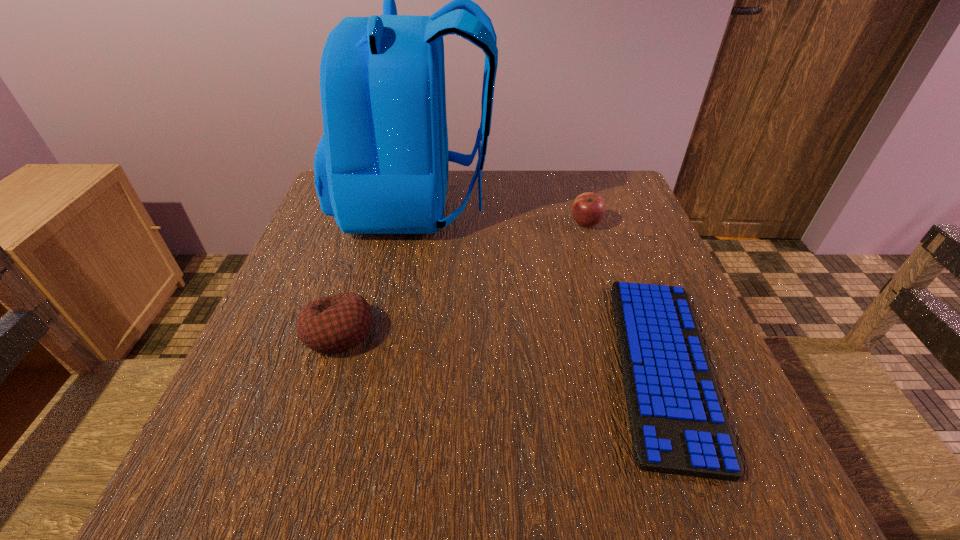
In the image, there is a desktop. At what (x,y) coordinates should I click in order to perform the action: click on vacant area at the right edge. Please return your answer as a coordinate pair (x, y). Looking at the image, I should click on (588, 250).

The height and width of the screenshot is (540, 960). Identify the location of free space at the far left corner. (327, 219).

This screenshot has width=960, height=540. In the image, there is a desktop. In order to click on vacant space at the near left corner in this screenshot , I will do `click(233, 458)`.

In the image, there is a desktop. Identify the location of vacant space at the far right corner. (606, 175).

At what (x,y) coordinates should I click in order to perform the action: click on free point at the near right corner. Please return your answer as a coordinate pair (x, y). This screenshot has height=540, width=960. Looking at the image, I should click on (717, 489).

Where is `free space that is in between the third tallest object and the shortest object`? free space that is in between the third tallest object and the shortest object is located at coordinates (501, 349).

You are a GUI agent. You are given a task and a screenshot of the screen. Output one action in this format:
    pyautogui.click(x=<x>, y=<y>)
    Task: Click on the unoccupied area between the second shortest object and the apple
    The image size is (960, 540).
    Given the screenshot: What is the action you would take?
    pyautogui.click(x=463, y=278)

Locate an element on the screen. This screenshot has height=540, width=960. vacant point located between the apple and the third tallest object is located at coordinates (463, 278).

Locate an element on the screen. The height and width of the screenshot is (540, 960). blank region between the apple and the beanbag is located at coordinates (463, 278).

Where is `vacant space that is in between the computer keyboard and the backpack`? The width and height of the screenshot is (960, 540). vacant space that is in between the computer keyboard and the backpack is located at coordinates pos(540,285).